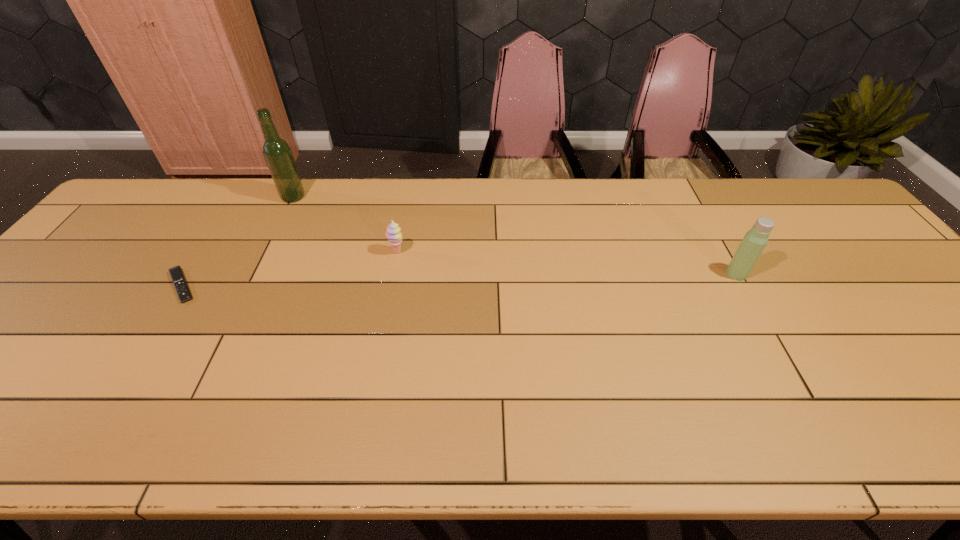
At what (x,y) coordinates should I click in order to perform the action: click on the farthest object. Please return your answer as a coordinate pair (x, y). Looking at the image, I should click on (277, 153).

Locate an element on the screen. The width and height of the screenshot is (960, 540). liquor is located at coordinates (277, 153).

The image size is (960, 540). In order to click on the second tallest object in this screenshot , I will do `click(755, 240)`.

Identify the location of thermos bottle. (755, 240).

The height and width of the screenshot is (540, 960). I want to click on sherbert, so click(x=393, y=234).

The width and height of the screenshot is (960, 540). What are the coordinates of `the second object from right to left` in the screenshot? It's located at (393, 234).

The image size is (960, 540). I want to click on the leftmost object, so click(x=177, y=276).

Identify the location of remote control. The width and height of the screenshot is (960, 540). (177, 276).

Where is `free space located 0.240m on the front of the liquor`? The width and height of the screenshot is (960, 540). free space located 0.240m on the front of the liquor is located at coordinates pos(264,256).

Find the location of a particular element. vacant region located 0.340m on the right of the rightmost object is located at coordinates (874, 274).